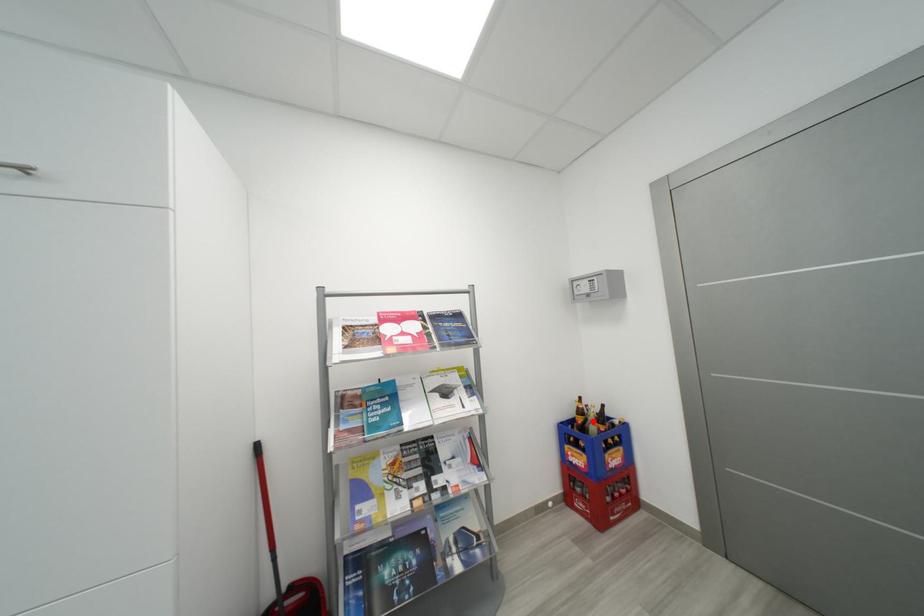
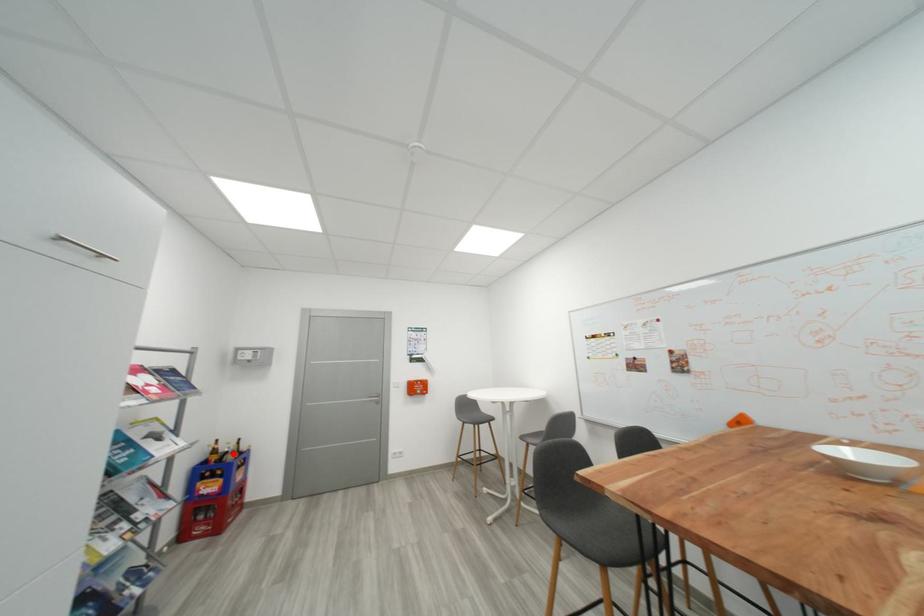
I am providing you with two images of the same scene from different viewpoints. A red point is marked on the first image and another point is marked on the second image. Is the red point in image1 aligned with the point shown in image2?

Yes